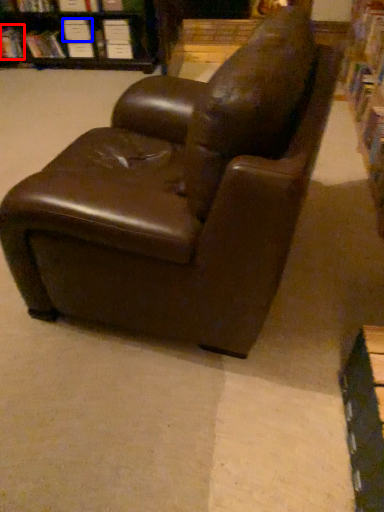
Question: Which of the following is the farthest to the observer, book (highlighted by a red box) or paperback book (highlighted by a blue box)?

Choices:
 (A) book
 (B) paperback book

Answer: (A)